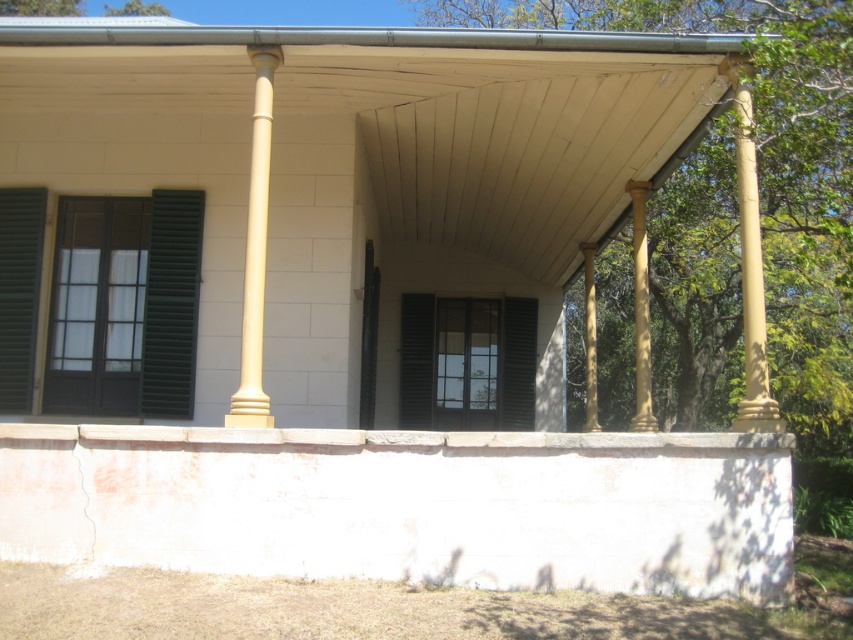
Question: Which point is farther from the camera taking this photo?

Choices:
 (A) (590, 392)
 (B) (35, 257)
 (C) (415, 355)

Answer: (C)

Question: Does creamy yellow column at center have a smaller size compared to golden polished column at center?

Choices:
 (A) yes
 (B) no

Answer: (A)

Question: Among these points, which one is farthest from the camera?

Choices:
 (A) (27, 241)
 (B) (258, 76)
 (C) (426, 298)

Answer: (C)

Question: Is dark green matte shutter at left smaller than matte gold column at right?

Choices:
 (A) no
 (B) yes

Answer: (B)

Question: Which point appears closest to the camera in this image?

Choices:
 (A) (746, 163)
 (B) (592, 246)
 (C) (10, 193)

Answer: (A)

Question: Does golden polished column at center appear over yellow polished wood column at center?

Choices:
 (A) no
 (B) yes

Answer: (B)